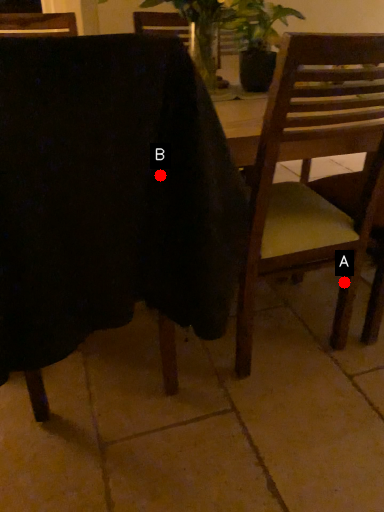
Question: Two points are circled on the image, labeled by A and B beside each circle. Which of the following is the farthest from the observer?

Choices:
 (A) A is further
 (B) B is further

Answer: (A)